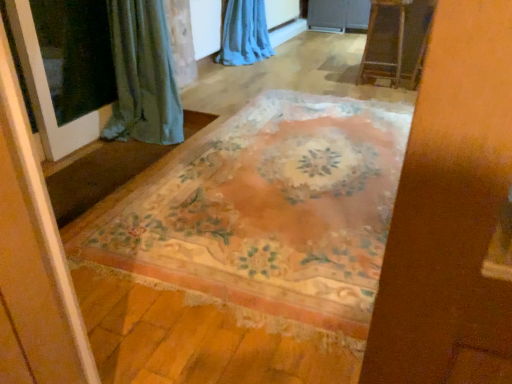
What do you see at coordinates (264, 215) in the screenshot?
I see `floral-patterned rug at center` at bounding box center [264, 215].

Where is `wooden ladder at upper right`? The image size is (512, 384). wooden ladder at upper right is located at coordinates (396, 41).

Identify the location of transparent glass screen door at left. This screenshot has width=512, height=384. (46, 90).

From a real-world perspective, is blue sheer curtain at upper center on top of wooden ladder at upper right?

Actually, blue sheer curtain at upper center is physically below wooden ladder at upper right in the real world.

Considering the sizes of blue sheer curtain at upper center and wooden ladder at upper right in the image, is blue sheer curtain at upper center wider or thinner than wooden ladder at upper right?

Clearly, blue sheer curtain at upper center has more width compared to wooden ladder at upper right.

Is blue sheer curtain at upper center far away from wooden ladder at upper right?

Absolutely, blue sheer curtain at upper center is distant from wooden ladder at upper right.

Considering the relative positions of blue sheer curtain at upper center and wooden ladder at upper right in the image provided, is blue sheer curtain at upper center to the left or to the right of wooden ladder at upper right?

blue sheer curtain at upper center is positioned on wooden ladder at upper right's left side.

Between transparent glass screen door at left and floral-patterned rug at center, which one has smaller width?

With smaller width is transparent glass screen door at left.

From the image's perspective, is transparent glass screen door at left on top of floral-patterned rug at center?

Yes, from the image's perspective, transparent glass screen door at left is on top of floral-patterned rug at center.

Which of these two, transparent glass screen door at left or floral-patterned rug at center, stands taller?

Standing taller between the two is transparent glass screen door at left.

Is point (31, 52) positioned in front of point (336, 187)?

No, (31, 52) is behind (336, 187).

Measure the distance from transparent glass screen door at left to wooden ladder at upper right.

transparent glass screen door at left and wooden ladder at upper right are 2.77 meters apart from each other.

From the image's perspective, which one is positioned higher, transparent glass screen door at left or wooden ladder at upper right?

wooden ladder at upper right.

Could wooden ladder at upper right be considered to be inside transparent glass screen door at left?

No, wooden ladder at upper right is not a part of transparent glass screen door at left.

Does transparent glass screen door at left have a smaller size compared to wooden ladder at upper right?

Correct, transparent glass screen door at left occupies less space than wooden ladder at upper right.

Is blue sheer curtain at upper center turned away from floral-patterned rug at center?

No.

In the image, is blue sheer curtain at upper center on the left side or the right side of floral-patterned rug at center?

Clearly, blue sheer curtain at upper center is on the left of floral-patterned rug at center in the image.

Is blue sheer curtain at upper center smaller than floral-patterned rug at center?

No.

Identify the location of mat that is on the right side of blue sheer curtain at upper center. (264, 215).

How different are the orientations of wooden ladder at upper right and blue sheer curtain at upper center in degrees?

There is a 91.3-degree angle between the facing directions of wooden ladder at upper right and blue sheer curtain at upper center.

Is wooden ladder at upper right inside or outside of blue sheer curtain at upper center?

wooden ladder at upper right cannot be found inside blue sheer curtain at upper center.

Is blue sheer curtain at upper center at the back of wooden ladder at upper right?

That's not correct — wooden ladder at upper right is not looking away from blue sheer curtain at upper center.

Does wooden ladder at upper right have a larger size compared to blue sheer curtain at upper center?

No, wooden ladder at upper right is not bigger than blue sheer curtain at upper center.

How different are the orientations of floral-patterned rug at center and transparent glass screen door at left in degrees?

They differ by 90.8 degrees in their facing directions.

Is floral-patterned rug at center at the left side of transparent glass screen door at left?

In fact, floral-patterned rug at center is to the right of transparent glass screen door at left.

Would you say transparent glass screen door at left is part of floral-patterned rug at center's contents?

Actually, transparent glass screen door at left is outside floral-patterned rug at center.

Between floral-patterned rug at center and transparent glass screen door at left, which one has smaller size?

transparent glass screen door at left.

Does wooden ladder at upper right lie in front of floral-patterned rug at center?

No, it is behind floral-patterned rug at center.

Does point (412, 70) appear closer or farther from the camera than point (326, 188)?

Point (412, 70) is positioned farther from the camera compared to point (326, 188).

Which is more to the left, wooden ladder at upper right or floral-patterned rug at center?

floral-patterned rug at center.

Find the location of `curtain beneath the wooden ladder at upper right (from a real-world perspective)`. curtain beneath the wooden ladder at upper right (from a real-world perspective) is located at coordinates (244, 34).

Identify the location of mat on the right of transparent glass screen door at left. The image size is (512, 384). (264, 215).

When comparing their distances from floral-patterned rug at center, does wooden ladder at upper right or transparent glass screen door at left seem closer?

transparent glass screen door at left is positioned closer to the anchor floral-patterned rug at center.

Which object lies further to the anchor point wooden ladder at upper right, transparent glass screen door at left or floral-patterned rug at center?

Among the two, transparent glass screen door at left is located further to wooden ladder at upper right.

When comparing their distances from blue sheer curtain at upper center, does floral-patterned rug at center or transparent glass screen door at left seem closer?

transparent glass screen door at left lies closer to blue sheer curtain at upper center than the other object.

When comparing their distances from blue sheer curtain at upper center, does transparent glass screen door at left or floral-patterned rug at center seem closer?

transparent glass screen door at left lies closer to blue sheer curtain at upper center than the other object.

Based on their spatial positions, is wooden ladder at upper right or blue sheer curtain at upper center closer to floral-patterned rug at center?

wooden ladder at upper right is closer to floral-patterned rug at center.

Based on their spatial positions, is blue sheer curtain at upper center or floral-patterned rug at center closer to wooden ladder at upper right?

blue sheer curtain at upper center is closer to wooden ladder at upper right.

From the image, which object appears to be nearer to floral-patterned rug at center, blue sheer curtain at upper center or transparent glass screen door at left?

Based on the image, transparent glass screen door at left appears to be nearer to floral-patterned rug at center.

Looking at the image, which one is located closer to floral-patterned rug at center, transparent glass screen door at left or wooden ladder at upper right?

Based on the image, transparent glass screen door at left appears to be nearer to floral-patterned rug at center.

Identify the location of curtain between transparent glass screen door at left and wooden ladder at upper right in the horizontal direction. This screenshot has height=384, width=512. (244, 34).

I want to click on screen door between floral-patterned rug at center and blue sheer curtain at upper center from front to back, so click(x=46, y=90).

Locate an element on the screen. Image resolution: width=512 pixels, height=384 pixels. mat situated between transparent glass screen door at left and wooden ladder at upper right from left to right is located at coordinates (264, 215).

Locate an element on the screen. furniture located between floral-patterned rug at center and blue sheer curtain at upper center in the depth direction is located at coordinates (396, 41).